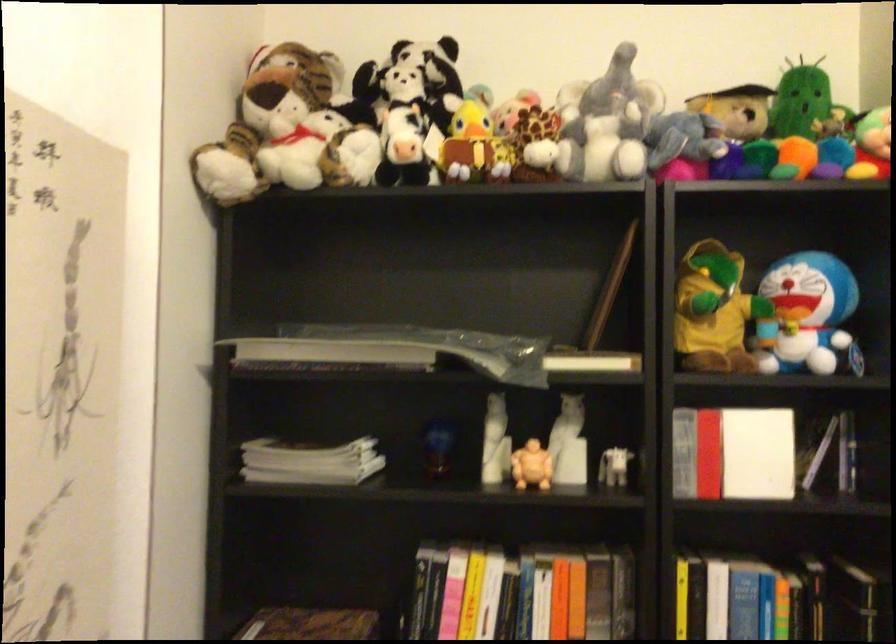
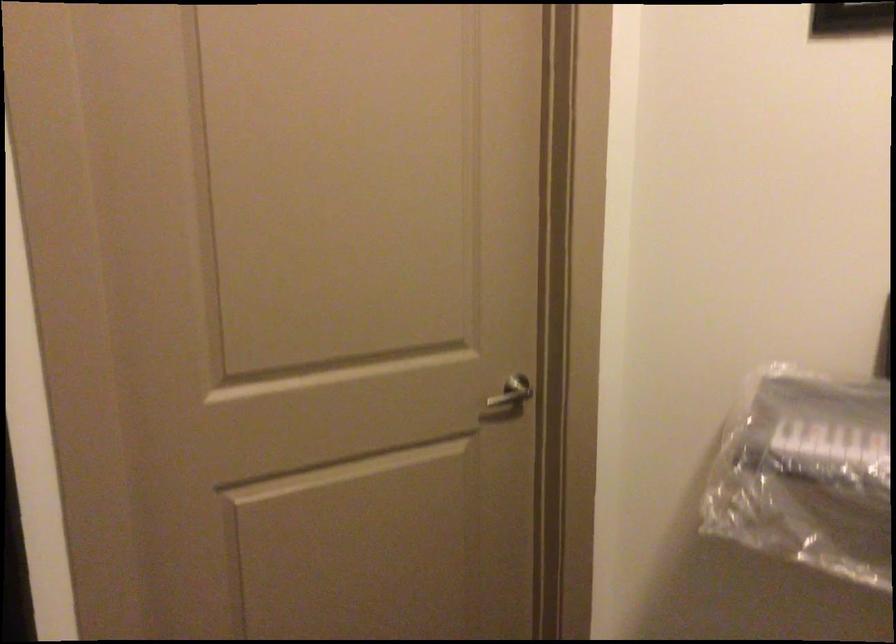
How did the camera likely rotate?

The camera rotated toward right-down.